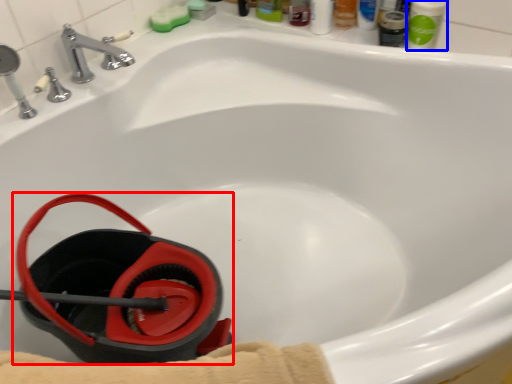
Question: Which object is further to the camera taking this photo, job (highlighted by a red box) or mouthwash (highlighted by a blue box)?

Choices:
 (A) job
 (B) mouthwash

Answer: (B)